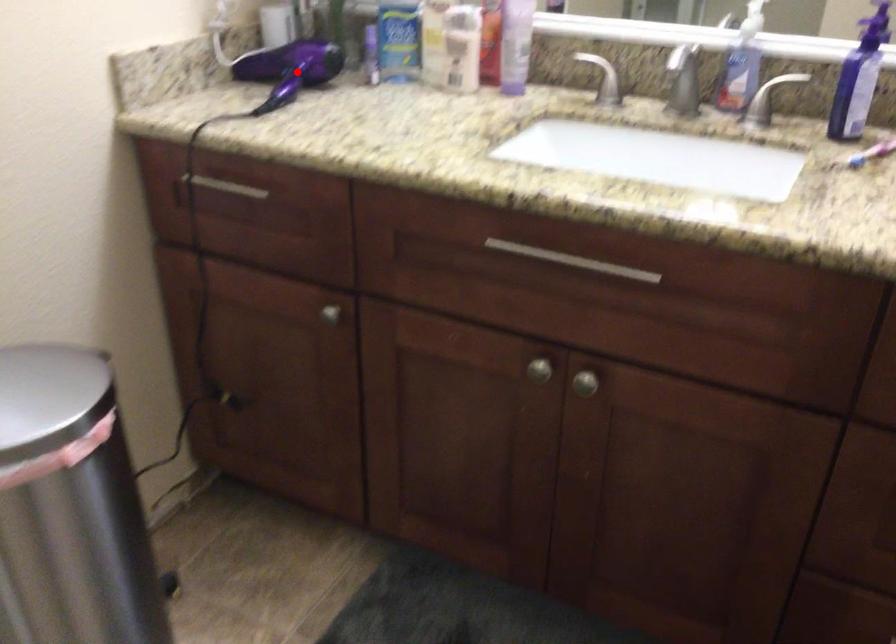
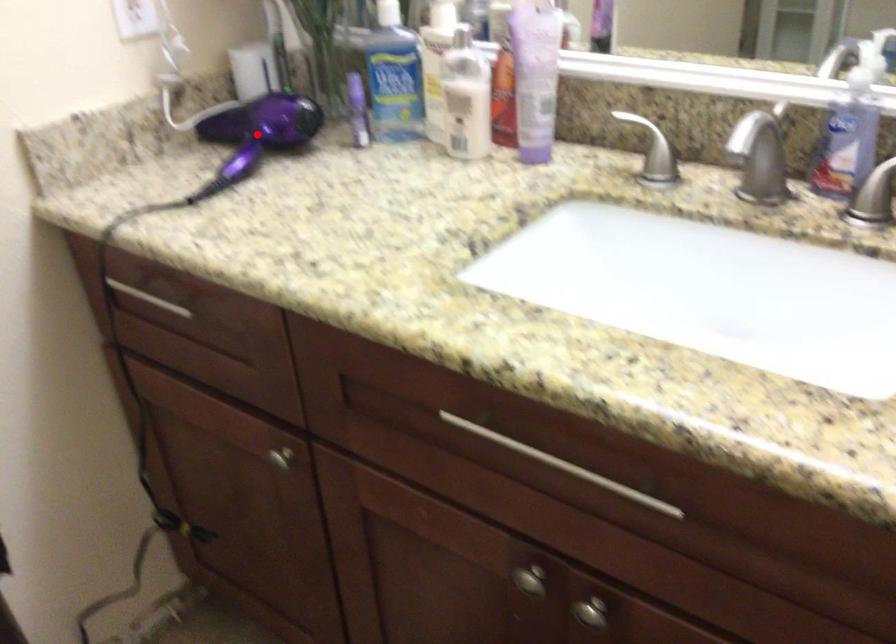
I am providing you with two images of the same scene from different viewpoints. A red point is marked on the first image and another point is marked on the second image. Do the highlighted points in image1 and image2 indicate the same real-world spot?

Yes